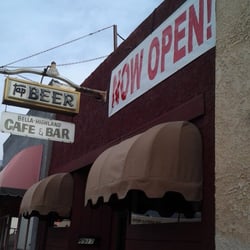
At what (x,y) coordinates should I click in order to perform the action: click on electric wire. Please return your answer as a coordinate pair (x, y). This screenshot has height=250, width=250. Looking at the image, I should click on (96, 31), (81, 60).